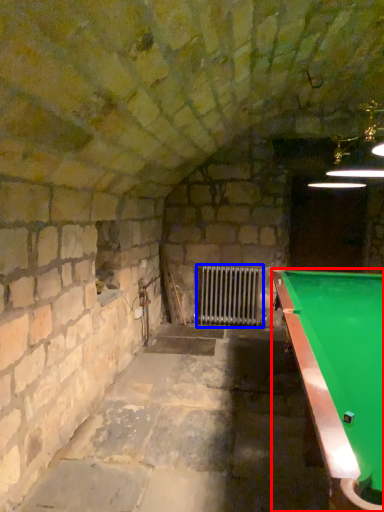
Question: Which of the following is the closest to the observer, billiard table (highlighted by a red box) or radiator (highlighted by a blue box)?

Choices:
 (A) billiard table
 (B) radiator

Answer: (A)